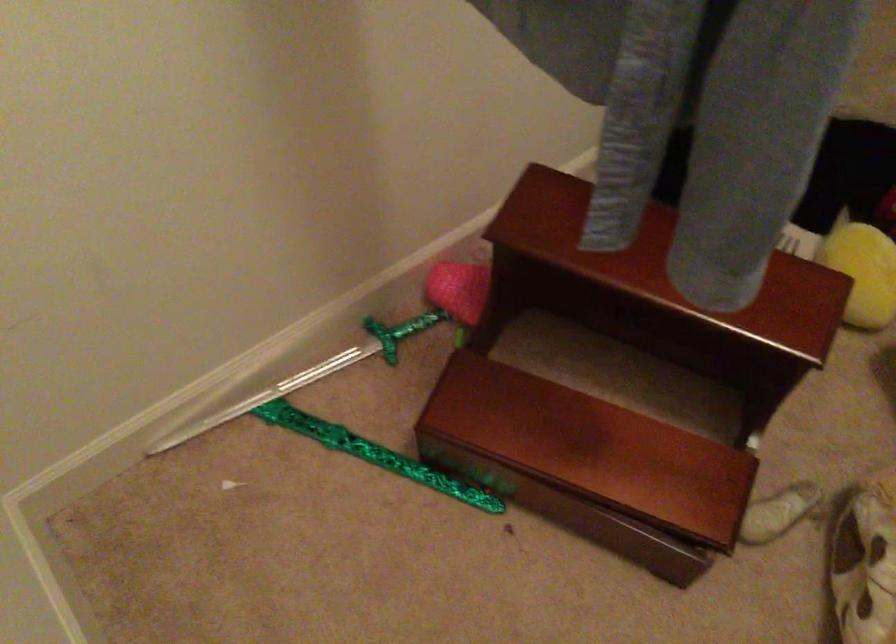
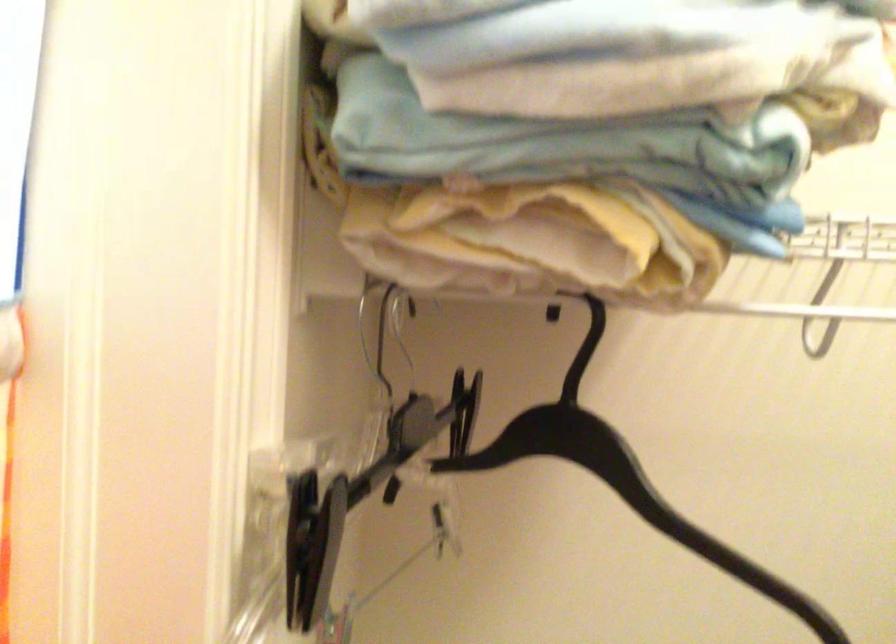
Consider the image. The first image is from the beginning of the video and the second image is from the end. How did the camera likely rotate when shooting the video?

The camera rotated toward left-up.